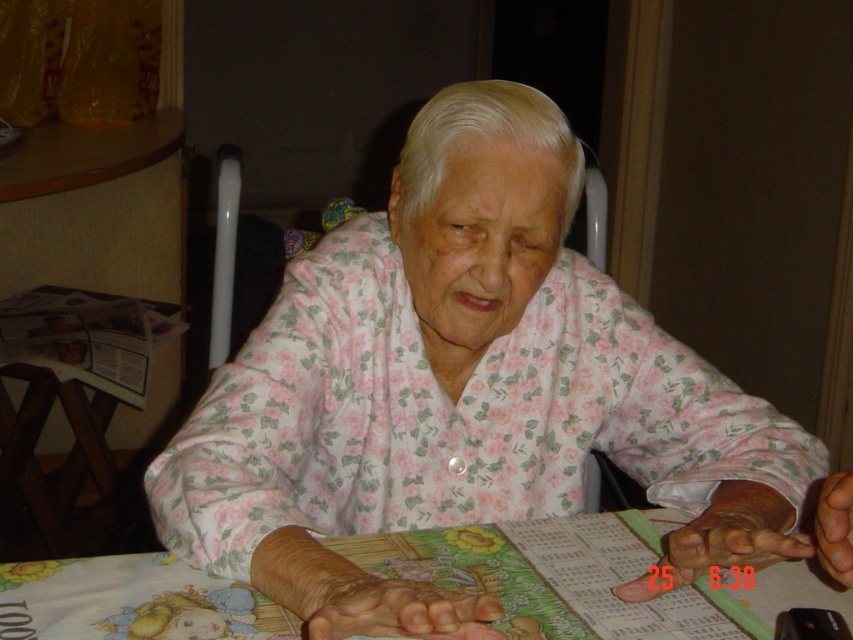
Question: Can you confirm if floral fabric tablecloth at center is bigger than smooth skin hand at center?

Choices:
 (A) yes
 (B) no

Answer: (A)

Question: Considering the relative positions of floral fabric tablecloth at center and brown leather hand at lower right in the image provided, where is floral fabric tablecloth at center located with respect to brown leather hand at lower right?

Choices:
 (A) below
 (B) above

Answer: (A)

Question: Which of the following is the closest to the observer?

Choices:
 (A) floral fabric at center
 (B) smooth skin hand at center

Answer: (A)

Question: Can you confirm if floral fabric tablecloth at center is positioned above brown leather hand at lower right?

Choices:
 (A) yes
 (B) no

Answer: (B)

Question: Which object is positioned farthest from the floral fabric at center?

Choices:
 (A) smooth skin hand at center
 (B) brown leather hand at lower right
 (C) dry skin at lower center

Answer: (B)

Question: Which object is the closest to the dry skin at lower center?

Choices:
 (A) brown leather hand at lower right
 (B) floral fabric at center
 (C) smooth skin hand at center
 (D) floral fabric tablecloth at center

Answer: (D)